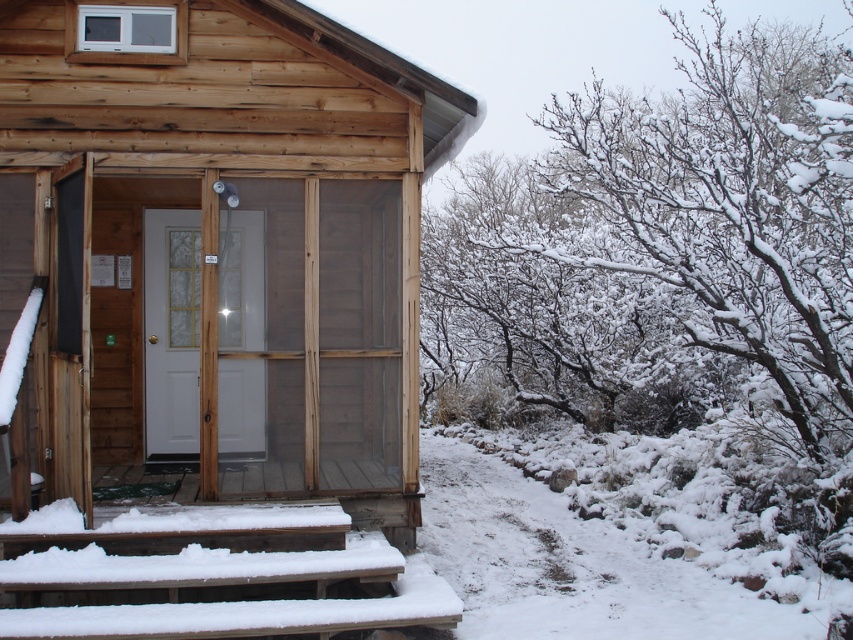
Is the position of snow-covered wooden stairs at lower left less distant than that of clear glass screen door at center?

Yes, snow-covered wooden stairs at lower left is in front of clear glass screen door at center.

Locate an element on the screen. The image size is (853, 640). snow-covered wooden stairs at lower left is located at coordinates (209, 573).

Find the location of `snow-covered wooden stairs at lower left`. snow-covered wooden stairs at lower left is located at coordinates (209, 573).

Can you confirm if snow-covered branches at upper right is positioned above snow-covered wooden stairs at lower left?

Yes.

In order to click on snow-covered branches at upper right in this screenshot , I will do `click(676, 244)`.

Between snow-covered branches at upper right and clear glass screen door at center, which one has more height?

snow-covered branches at upper right is taller.

Who is shorter, snow-covered branches at upper right or clear glass screen door at center?

clear glass screen door at center is shorter.

Image resolution: width=853 pixels, height=640 pixels. Find the location of `snow-covered branches at upper right`. snow-covered branches at upper right is located at coordinates (676, 244).

This screenshot has height=640, width=853. I want to click on snow-covered branches at upper right, so click(x=676, y=244).